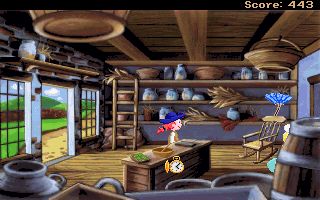
Identify the location of bowls. The width and height of the screenshot is (320, 200). (208, 74), (280, 58), (88, 27), (153, 74), (121, 117), (126, 95), (38, 176), (214, 183), (201, 183).